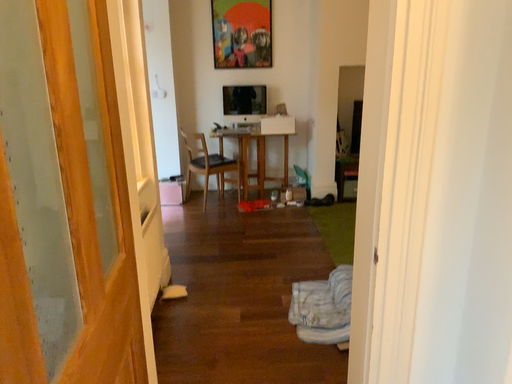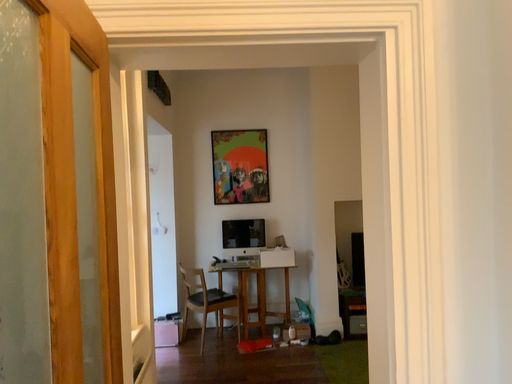
Question: Which way did the camera rotate in the video?

Choices:
 (A) rotated downward
 (B) rotated upward

Answer: (B)